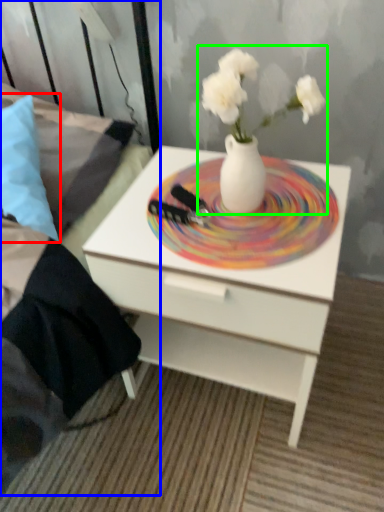
Question: Which object is the farthest from pillow (highlighted by a red box)? Choose among these: bed frame (highlighted by a blue box) or floral arrangement (highlighted by a green box).

Choices:
 (A) bed frame
 (B) floral arrangement

Answer: (B)